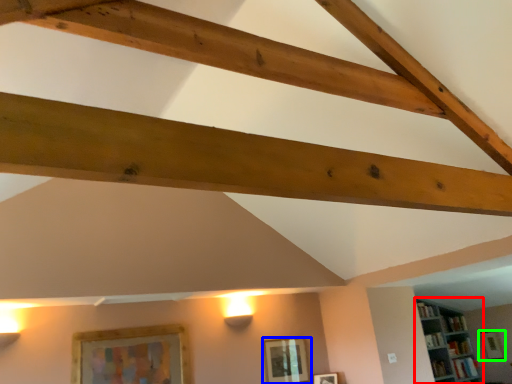
Question: Which object is positioned farthest from shelf (highlighted by a red box)? Select from picture frame (highlighted by a blue box) and picture frame (highlighted by a green box).

Choices:
 (A) picture frame
 (B) picture frame

Answer: (A)